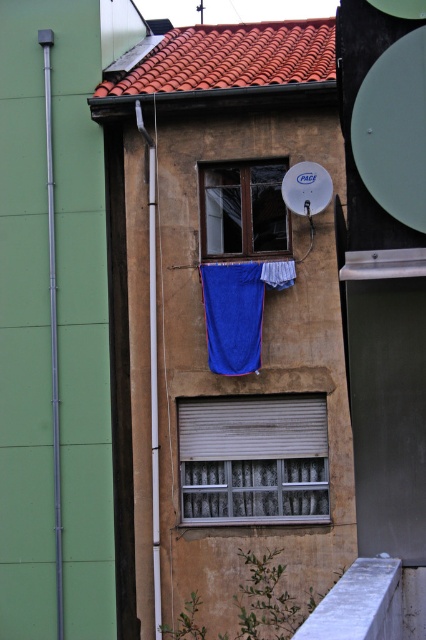
Is blue fabric curtain at center to the left of blue fabric at center from the viewer's perspective?

Indeed, blue fabric curtain at center is positioned on the left side of blue fabric at center.

Is blue fabric curtain at center smaller than blue fabric at center?

No.

What are the coordinates of `blue fabric curtain at center` in the screenshot? It's located at (233, 316).

Does point (264, 413) come farther from viewer compared to point (230, 336)?

That is True.

Identify the location of metallic silver window at center. The image size is (426, 640). (253, 458).

Can you confirm if metallic silver window at center is positioned above blue fabric at center?

Actually, metallic silver window at center is below blue fabric at center.

The height and width of the screenshot is (640, 426). What do you see at coordinates (253, 458) in the screenshot?
I see `metallic silver window at center` at bounding box center [253, 458].

Who is more distant from viewer, (232, 449) or (284, 280)?

Positioned behind is point (232, 449).

Where is `metallic silver window at center`? metallic silver window at center is located at coordinates (253, 458).